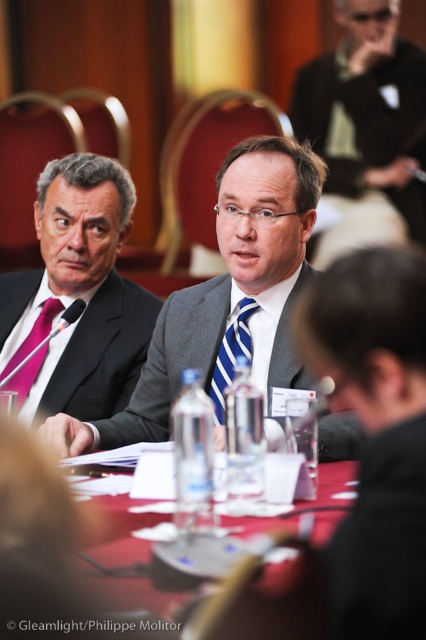
Question: Which point is farther from the camera taking this photo?

Choices:
 (A) (32, 328)
 (B) (224, 340)
 (C) (222, 342)
 (D) (152, 579)

Answer: (A)

Question: Which object is closer to the camera taking this photo?

Choices:
 (A) blue striped tie at center
 (B) gray suit at center
 (C) pink silk tie at left

Answer: (B)

Question: Can you confirm if gray suit at center is positioned below matte black suit at center?

Choices:
 (A) no
 (B) yes

Answer: (B)

Question: From the image, what is the correct spatial relationship of pink silk tie at left in relation to pink satin tie at left?

Choices:
 (A) right
 (B) left

Answer: (A)

Question: Which point appears closest to the camera in this image?

Choices:
 (A) tap(238, 220)
 (B) tap(425, 70)

Answer: (A)

Question: Does gray suit at center have a larger size compared to matte black suit at center?

Choices:
 (A) yes
 (B) no

Answer: (A)